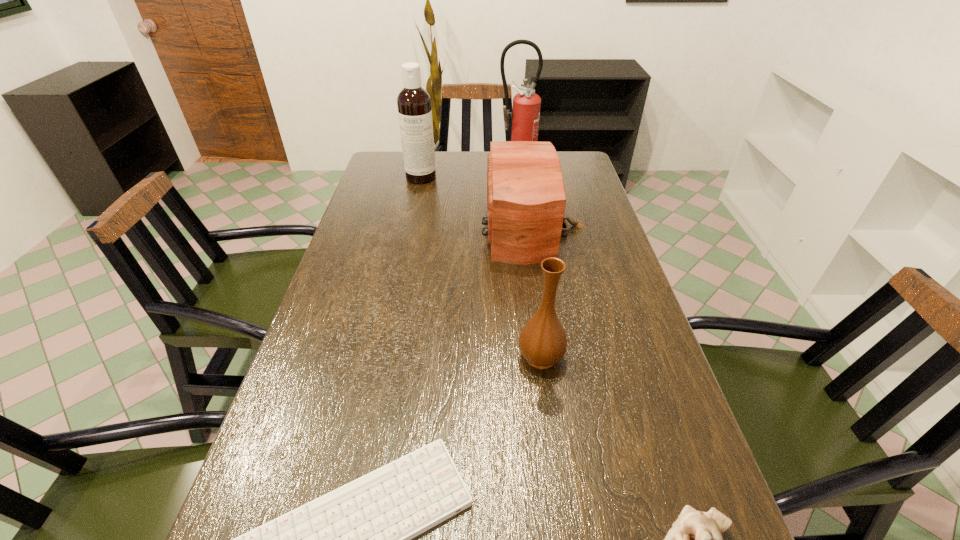
At what (x,y) coordinates should I click in order to perform the action: click on fire extinguisher that is at the far edge. Please return your answer as a coordinate pair (x, y). This screenshot has height=540, width=960. Looking at the image, I should click on (525, 116).

The height and width of the screenshot is (540, 960). Identify the location of dishwasher detergent at the far edge. (413, 102).

The image size is (960, 540). I want to click on object situated at the left edge, so click(413, 102).

Locate an element on the screen. This screenshot has width=960, height=540. object that is at the right edge is located at coordinates (526, 199).

This screenshot has height=540, width=960. In order to click on object at the far left corner in this screenshot , I will do `click(413, 102)`.

Where is `blank space at the far edge of the desktop`? blank space at the far edge of the desktop is located at coordinates (469, 160).

Locate an element on the screen. The width and height of the screenshot is (960, 540). vacant space at the left edge of the desktop is located at coordinates (337, 441).

Image resolution: width=960 pixels, height=540 pixels. I want to click on free point at the right edge, so click(592, 255).

The width and height of the screenshot is (960, 540). In the image, there is a desktop. In order to click on free region at the far left corner in this screenshot , I will do `click(393, 179)`.

Find the location of a particular element. Image resolution: width=960 pixels, height=540 pixels. vacant area at the far right corner of the desktop is located at coordinates (586, 167).